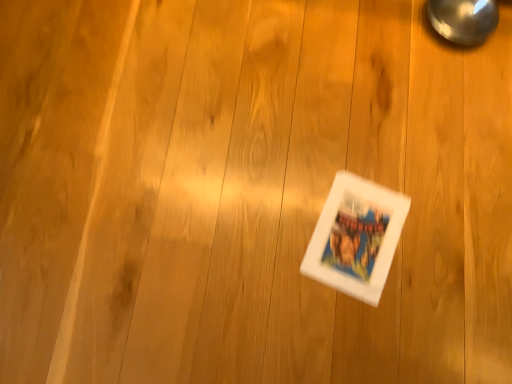
Question: Is the depth of polished metallic magnifying glass at upper right greater than that of white matte comic book at center?

Choices:
 (A) yes
 (B) no

Answer: (A)

Question: From a real-world perspective, does polished metallic magnifying glass at upper right stand above white matte comic book at center?

Choices:
 (A) no
 (B) yes

Answer: (B)

Question: Is polished metallic magnifying glass at upper right to the left of white matte comic book at center from the viewer's perspective?

Choices:
 (A) yes
 (B) no

Answer: (B)

Question: Could you tell me if polished metallic magnifying glass at upper right is turned towards white matte comic book at center?

Choices:
 (A) yes
 (B) no

Answer: (A)

Question: Considering the relative sizes of polished metallic magnifying glass at upper right and white matte comic book at center in the image provided, is polished metallic magnifying glass at upper right smaller than white matte comic book at center?

Choices:
 (A) yes
 (B) no

Answer: (B)

Question: Is polished metallic magnifying glass at upper right thinner than white matte comic book at center?

Choices:
 (A) yes
 (B) no

Answer: (A)

Question: Can you confirm if white matte comic book at center is bigger than polished metallic magnifying glass at upper right?

Choices:
 (A) no
 (B) yes

Answer: (A)

Question: From the image's perspective, is white matte comic book at center under polished metallic magnifying glass at upper right?

Choices:
 (A) no
 (B) yes

Answer: (B)

Question: Is white matte comic book at center turned away from polished metallic magnifying glass at upper right?

Choices:
 (A) yes
 (B) no

Answer: (B)

Question: Can you confirm if white matte comic book at center is positioned to the right of polished metallic magnifying glass at upper right?

Choices:
 (A) no
 (B) yes

Answer: (A)

Question: Is polished metallic magnifying glass at upper right a part of white matte comic book at center?

Choices:
 (A) yes
 (B) no

Answer: (B)

Question: Is white matte comic book at center facing towards polished metallic magnifying glass at upper right?

Choices:
 (A) no
 (B) yes

Answer: (A)

Question: Is white matte comic book at center wider or thinner than polished metallic magnifying glass at upper right?

Choices:
 (A) thin
 (B) wide

Answer: (B)